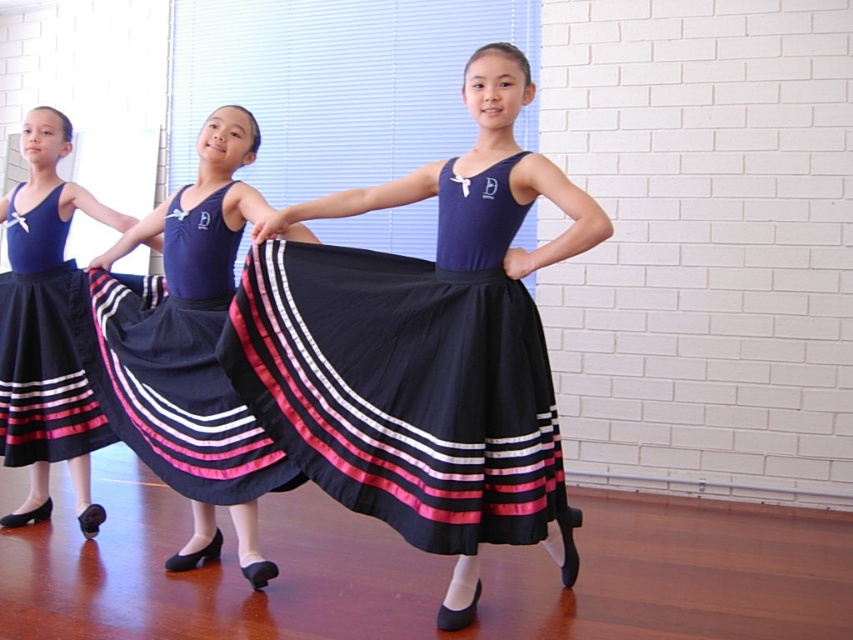
Does matte black skirt at center have a larger size compared to matte black skirt at left?

Correct, matte black skirt at center is larger in size than matte black skirt at left.

Does matte black skirt at center come in front of matte black skirt at left?

No, it is behind matte black skirt at left.

Image resolution: width=853 pixels, height=640 pixels. What do you see at coordinates (45, 328) in the screenshot?
I see `matte black skirt at center` at bounding box center [45, 328].

The image size is (853, 640). I want to click on matte black skirt at center, so click(45, 328).

Between black satin skirt at center and matte black skirt at center, which one has more height?

With more height is matte black skirt at center.

Which is above, black satin skirt at center or matte black skirt at center?

Positioned higher is matte black skirt at center.

The width and height of the screenshot is (853, 640). I want to click on black satin skirt at center, so click(408, 376).

Who is taller, navy satin skirt at center or matte black skirt at left?

matte black skirt at left

Between navy satin skirt at center and matte black skirt at left, which one has less height?

With less height is navy satin skirt at center.

Is point (172, 417) more distant than point (9, 340)?

No, it is not.

This screenshot has height=640, width=853. Find the location of `navy satin skirt at center`. navy satin skirt at center is located at coordinates (180, 365).